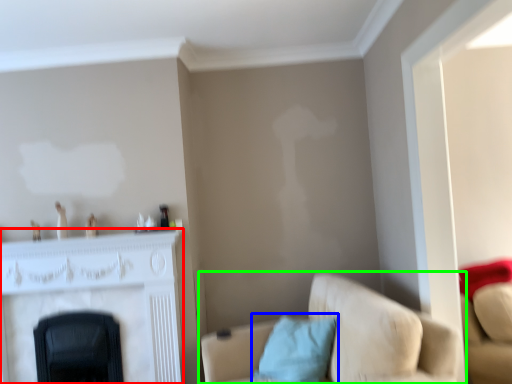
Question: Considering the real-world distances, which object is closest to fireplace (highlighted by a red box)? pillow (highlighted by a blue box) or studio couch (highlighted by a green box).

Choices:
 (A) pillow
 (B) studio couch

Answer: (A)